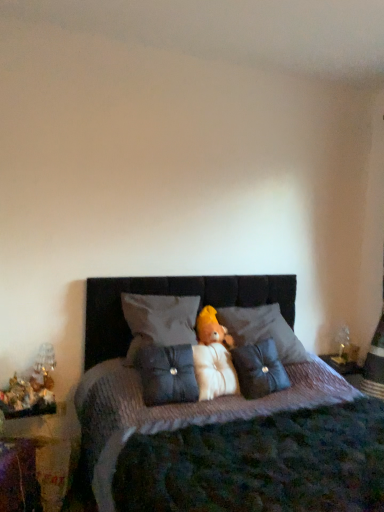
You are a GUI agent. You are given a task and a screenshot of the screen. Output one action in this format:
    pyautogui.click(x=<x>, y=<y>)
    Task: Click on the suede-like dark blue pillow at center, the 2th pillow viewed from the right
    
    Given the screenshot: What is the action you would take?
    pyautogui.click(x=167, y=374)

Identify the location of gray fabric pillow at center, which is the 3th pillow from right to left. The image size is (384, 512). (159, 320).

In order to face velvet plush bear at center, should I rotate leftwards or rightwards?

Rotate your view right by about 2.543°.

This screenshot has width=384, height=512. In order to click on velvet plush bear at center in this screenshot , I will do `click(213, 357)`.

Identify the location of velvet dark brown bed at center. Image resolution: width=384 pixels, height=512 pixels. (231, 446).

This screenshot has height=512, width=384. Identify the location of suede-like dark blue pillow at center, the 2th pillow viewed from the right. (167, 374).

In the scene shown: From a real-world perspective, is suede-like dark blue pillow at center, the second pillow from the left, above or below soft yellow plush bear at center?

In terms of real-world spatial position, suede-like dark blue pillow at center, the second pillow from the left, is below soft yellow plush bear at center.

Considering the sizes of suede-like dark blue pillow at center, the second pillow from the left, and soft yellow plush bear at center in the image, is suede-like dark blue pillow at center, the second pillow from the left, taller or shorter than soft yellow plush bear at center?

In the image, suede-like dark blue pillow at center, the second pillow from the left, appears to be taller than soft yellow plush bear at center.

Is soft yellow plush bear at center completely or partially inside suede-like dark blue pillow at center, the 2th pillow viewed from the right?

That's incorrect, soft yellow plush bear at center is not inside suede-like dark blue pillow at center, the 2th pillow viewed from the right.

Is metallic silver toy at left not within suede-like dark blue pillow at center, the 2th pillow viewed from the right?

Indeed, metallic silver toy at left is completely outside suede-like dark blue pillow at center, the 2th pillow viewed from the right.

Locate an element on the screen. This screenshot has width=384, height=512. toy on the left of the suede-like dark blue pillow at center, the 2th pillow viewed from the right is located at coordinates (18, 396).

Would you say metallic silver toy at left is a long distance from suede-like dark blue pillow at center, the second pillow from the left?

No, metallic silver toy at left is not far from suede-like dark blue pillow at center, the second pillow from the left.

From the image's perspective, which one is positioned higher, metallic silver toy at left or suede-like dark blue pillow at center, the second pillow from the left?

suede-like dark blue pillow at center, the second pillow from the left, appears higher in the image.

Looking at this image, from their relative heights in the image, would you say dark blue fabric pillow at center, the first pillow viewed from the right, is taller or shorter than velvet plush bear at center?

Considering their sizes, dark blue fabric pillow at center, the first pillow viewed from the right, has more height than velvet plush bear at center.

Which object is positioned more to the right, dark blue fabric pillow at center, the first pillow viewed from the right, or velvet plush bear at center?

From the viewer's perspective, dark blue fabric pillow at center, the first pillow viewed from the right, appears more on the right side.

From a real-world perspective, is dark blue fabric pillow at center, the first pillow viewed from the right, located higher than velvet plush bear at center?

Yes, from a real-world perspective, dark blue fabric pillow at center, the first pillow viewed from the right, is above velvet plush bear at center.

From the image's perspective, is velvet dark brown bed at center above or below soft yellow plush bear at center?

Based on their image positions, velvet dark brown bed at center is located beneath soft yellow plush bear at center.

Relative to soft yellow plush bear at center, is velvet dark brown bed at center in front or behind?

In the image, velvet dark brown bed at center appears in front of soft yellow plush bear at center.

Can you confirm if velvet dark brown bed at center is thinner than soft yellow plush bear at center?

In fact, velvet dark brown bed at center might be wider than soft yellow plush bear at center.

Is velvet dark brown bed at center beside soft yellow plush bear at center?

velvet dark brown bed at center and soft yellow plush bear at center are not in contact.

Is velvet plush bear at center looking in the opposite direction of soft yellow plush bear at center?

velvet plush bear at center does not have its back to soft yellow plush bear at center.

Do you think velvet plush bear at center is within soft yellow plush bear at center, or outside of it?

velvet plush bear at center lies outside soft yellow plush bear at center.

Can you confirm if velvet plush bear at center is thinner than soft yellow plush bear at center?

Incorrect, the width of velvet plush bear at center is not less than that of soft yellow plush bear at center.

Considering the positions of objects velvet plush bear at center and soft yellow plush bear at center in the image provided, who is more to the left, velvet plush bear at center or soft yellow plush bear at center?

velvet plush bear at center.

Which is behind, point (160, 347) or point (201, 378)?

The point (160, 347) is behind.

You are a GUI agent. You are given a task and a screenshot of the screen. Output one action in this format:
    pyautogui.click(x=<x>, y=<y>)
    Task: Click on the doll lying on the right of suede-like dark blue pillow at center, the second pillow from the left
    The width and height of the screenshot is (384, 512).
    Given the screenshot: What is the action you would take?
    pyautogui.click(x=213, y=357)

Is suede-like dark blue pillow at center, the 2th pillow viewed from the right, inside or outside of velvet plush bear at center?

suede-like dark blue pillow at center, the 2th pillow viewed from the right, is spatially situated outside velvet plush bear at center.

Does gray fabric pillow at center, which is the 3th pillow from right to left, come in front of suede-like dark blue pillow at center, the 2th pillow viewed from the right?

No.

What are the coordinates of `pillow on the left of suede-like dark blue pillow at center, the second pillow from the left` in the screenshot? It's located at (159, 320).

Is gray fabric pillow at center, which is counted as the first pillow, starting from the left, facing towards suede-like dark blue pillow at center, the second pillow from the left?

No.

Where is `animal on the right of suede-like dark blue pillow at center, the 2th pillow viewed from the right`? animal on the right of suede-like dark blue pillow at center, the 2th pillow viewed from the right is located at coordinates (211, 328).

The width and height of the screenshot is (384, 512). What are the coordinates of `the 2nd pillow above the metallic silver toy at left (from a real-world perspective)` in the screenshot? It's located at 167,374.

Which object lies further to the anchor point dark blue fabric pillow at center, the first pillow viewed from the right, gray fabric pillow at center, which is the 3th pillow from right to left, or soft yellow plush bear at center?

gray fabric pillow at center, which is the 3th pillow from right to left.

Based on their spatial positions, is velvet plush bear at center or gray fabric pillow at center, which is counted as the first pillow, starting from the left, closer to velvet dark brown bed at center?

velvet plush bear at center lies closer to velvet dark brown bed at center than the other object.

Based on their spatial positions, is soft yellow plush bear at center or metallic silver toy at left further from velvet dark brown bed at center?

metallic silver toy at left is positioned further to the anchor velvet dark brown bed at center.

When comparing their distances from velvet plush bear at center, does velvet dark brown bed at center or dark blue fabric pillow at center, marked as the 3th pillow in a left-to-right arrangement, seem further?

velvet dark brown bed at center is positioned further to the anchor velvet plush bear at center.

Considering their positions, is velvet plush bear at center positioned closer to velvet dark brown bed at center than dark blue fabric pillow at center, marked as the 3th pillow in a left-to-right arrangement?

velvet plush bear at center.

Which object lies further to the anchor point velvet plush bear at center, velvet dark brown bed at center or soft yellow plush bear at center?

velvet dark brown bed at center is further to velvet plush bear at center.

From the image, which object appears to be farther from soft yellow plush bear at center, suede-like dark blue pillow at center, the 2th pillow viewed from the right, or velvet dark brown bed at center?

Among the two, velvet dark brown bed at center is located further to soft yellow plush bear at center.

In the scene shown: Looking at the image, which one is located further to metallic silver toy at left, soft yellow plush bear at center or dark blue fabric pillow at center, marked as the 3th pillow in a left-to-right arrangement?

Based on the image, dark blue fabric pillow at center, marked as the 3th pillow in a left-to-right arrangement, appears to be further to metallic silver toy at left.

The height and width of the screenshot is (512, 384). I want to click on doll positioned between velvet dark brown bed at center and gray fabric pillow at center, which is counted as the first pillow, starting from the left, from near to far, so click(213, 357).

Identify the location of animal between metallic silver toy at left and dark blue fabric pillow at center, marked as the 3th pillow in a left-to-right arrangement. (211, 328).

Where is `doll located between gray fabric pillow at center, which is counted as the first pillow, starting from the left, and soft yellow plush bear at center in the left-right direction`? doll located between gray fabric pillow at center, which is counted as the first pillow, starting from the left, and soft yellow plush bear at center in the left-right direction is located at coordinates (213, 357).

This screenshot has height=512, width=384. I want to click on doll between suede-like dark blue pillow at center, the second pillow from the left, and dark blue fabric pillow at center, the first pillow viewed from the right, from left to right, so click(213, 357).